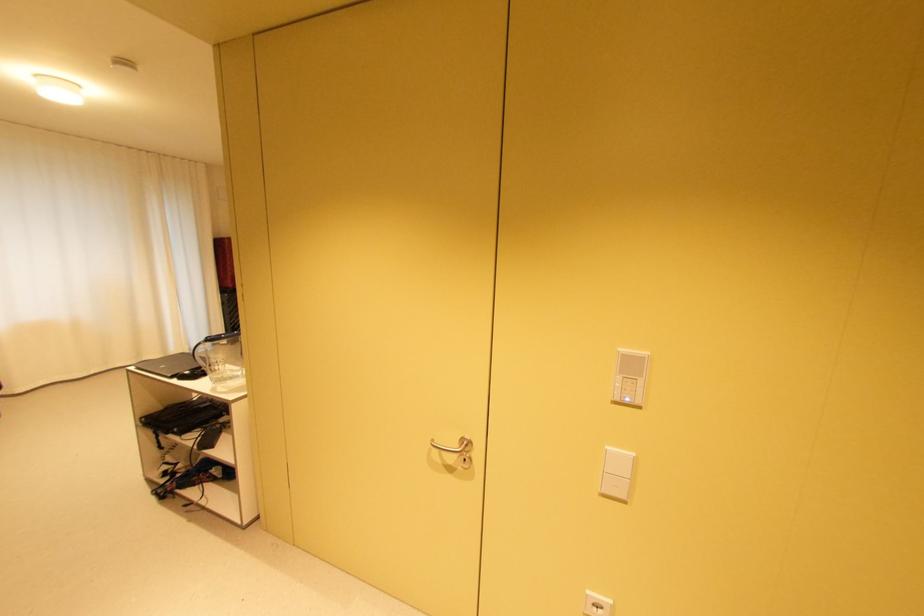
Find where to push the white light switch. Please return your answer as a coordinate pair (x, y).

(616, 474)